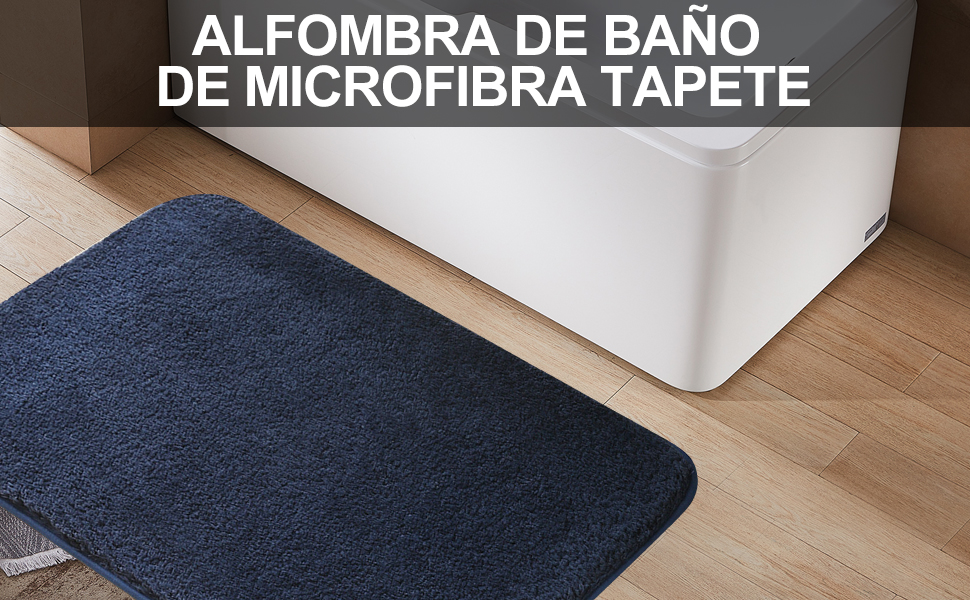
Image resolution: width=970 pixels, height=600 pixels. Identify the location of corner of wall. (86, 135).